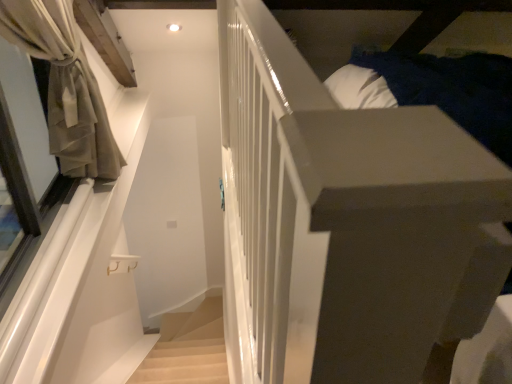
Question: Which direction should I rotate to look at light beige carpeted stairs at lower center?

Choices:
 (A) left
 (B) right

Answer: (A)

Question: Is beige sheer curtain at left completely or partially outside of light beige carpeted stairs at lower center?

Choices:
 (A) yes
 (B) no

Answer: (A)

Question: Does beige sheer curtain at left have a greater height compared to light beige carpeted stairs at lower center?

Choices:
 (A) yes
 (B) no

Answer: (A)

Question: From a real-world perspective, is beige sheer curtain at left positioned over light beige carpeted stairs at lower center based on gravity?

Choices:
 (A) yes
 (B) no

Answer: (A)

Question: Is beige sheer curtain at left beside light beige carpeted stairs at lower center?

Choices:
 (A) no
 (B) yes

Answer: (A)

Question: Does beige sheer curtain at left have a greater width compared to light beige carpeted stairs at lower center?

Choices:
 (A) no
 (B) yes

Answer: (B)

Question: Is beige sheer curtain at left aimed at light beige carpeted stairs at lower center?

Choices:
 (A) no
 (B) yes

Answer: (A)

Question: From a real-world perspective, is light beige carpeted stairs at lower center located beneath beige sheer curtain at left?

Choices:
 (A) yes
 (B) no

Answer: (A)

Question: Is light beige carpeted stairs at lower center facing away from beige sheer curtain at left?

Choices:
 (A) no
 (B) yes

Answer: (A)

Question: From a real-world perspective, is light beige carpeted stairs at lower center located higher than beige sheer curtain at left?

Choices:
 (A) no
 (B) yes

Answer: (A)

Question: Is light beige carpeted stairs at lower center not near beige sheer curtain at left?

Choices:
 (A) yes
 (B) no

Answer: (A)

Question: Does light beige carpeted stairs at lower center have a greater height compared to beige sheer curtain at left?

Choices:
 (A) no
 (B) yes

Answer: (A)

Question: Can you confirm if light beige carpeted stairs at lower center is positioned to the right of beige sheer curtain at left?

Choices:
 (A) no
 (B) yes

Answer: (B)

Question: Based on their sizes in the image, would you say beige sheer curtain at left is bigger or smaller than light beige carpeted stairs at lower center?

Choices:
 (A) big
 (B) small

Answer: (A)